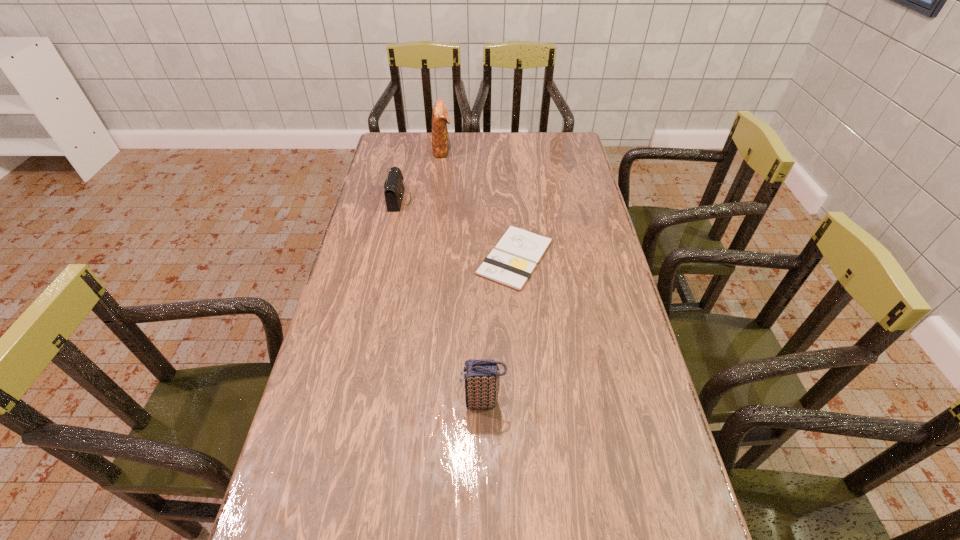
In order to click on free space that satisfies the following two spatial constraints: 1. on the back side of the second nearest object; 2. on the front flap of the leftmost object in this screenshot , I will do `click(511, 200)`.